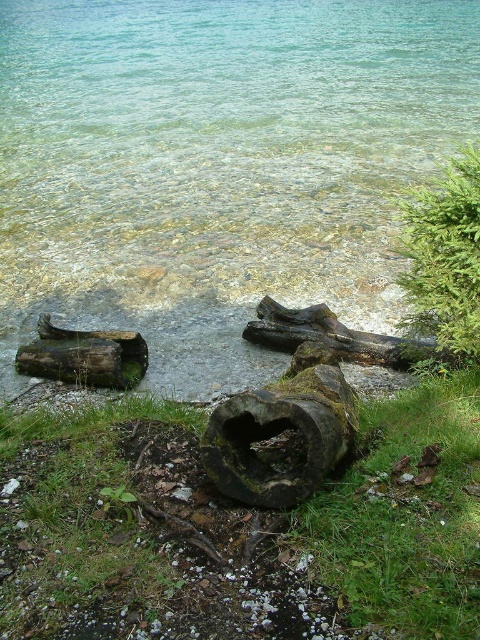
Question: Does green textured tree at upper right have a greater width compared to dark brown rough log at center?

Choices:
 (A) yes
 (B) no

Answer: (B)

Question: Which point appears closest to the camera in this image?

Choices:
 (A) (415, 502)
 (B) (385, 129)
 (C) (450, 316)

Answer: (A)

Question: Which object appears farthest from the camera in this image?

Choices:
 (A) green mossy log at lower center
 (B) clear water at center
 (C) dark brown rough tree trunk at center

Answer: (B)

Question: Does green mossy log at lower center appear under green mossy grass at lower center?

Choices:
 (A) no
 (B) yes

Answer: (B)

Question: Which point is farther to the camera?

Choices:
 (A) green textured tree at upper right
 (B) dark brown rough tree trunk at center
 (C) green mossy log at lower center

Answer: (A)

Question: Can you confirm if dark brown rough log at center is wider than dark brown wood log at lower left?

Choices:
 (A) yes
 (B) no

Answer: (A)